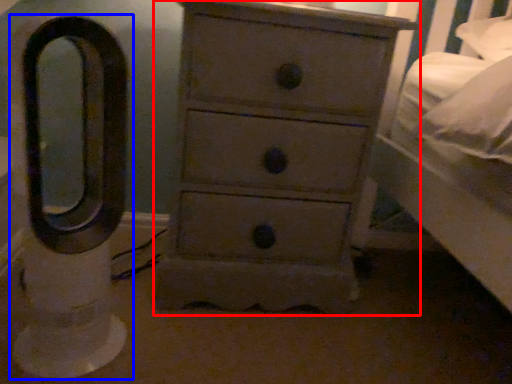
Question: Among these objects, which one is nearest to the camera, chest of drawers (highlighted by a red box) or swivel chair (highlighted by a blue box)?

Choices:
 (A) chest of drawers
 (B) swivel chair

Answer: (B)